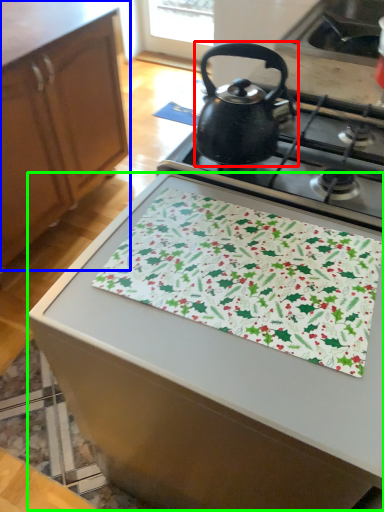
Question: Which is nearer to the kettle (highlighted by a red box)? cabinetry (highlighted by a blue box) or table (highlighted by a green box).

Choices:
 (A) cabinetry
 (B) table

Answer: (B)